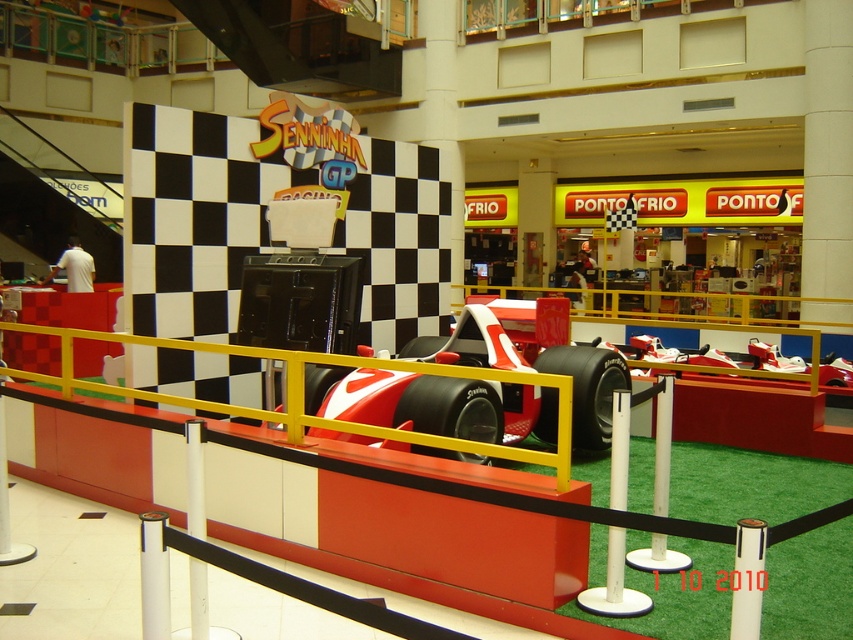
Question: Which of the following is the closest to the observer?

Choices:
 (A) white plastic pole at center
 (B) red matte race car at center

Answer: (A)

Question: Is red matte race car at center wider than white plastic pole at center?

Choices:
 (A) yes
 (B) no

Answer: (A)

Question: Is red matte race car at center to the left of white plastic pole at center from the viewer's perspective?

Choices:
 (A) no
 (B) yes

Answer: (A)

Question: Is red matte race car at center positioned behind white plastic pole at center?

Choices:
 (A) no
 (B) yes

Answer: (B)

Question: Which point is closer to the camera?

Choices:
 (A) red matte race car at center
 (B) white plastic pole at center

Answer: (B)